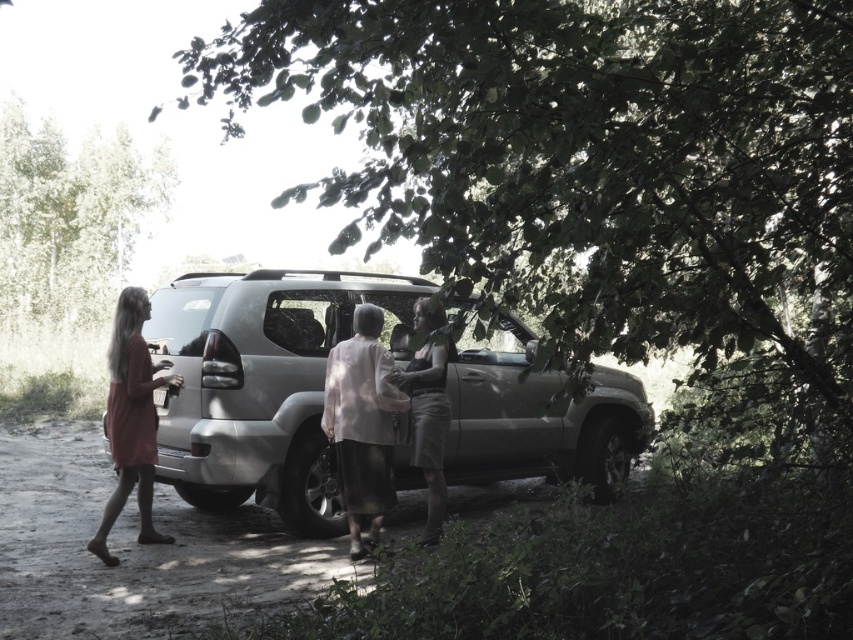
Question: Which object appears closest to the camera in this image?

Choices:
 (A) green leafy tree at center
 (B) satin silver jeep at center

Answer: (A)

Question: Which object is the closest to the light beige skirt at center?

Choices:
 (A) satin silver jeep at center
 (B) green leafy tree at center
 (C) matte pink dress at left
 (D) green leafy tree at upper left

Answer: (A)

Question: Does light beige fabric coat at center appear under matte pink dress at left?

Choices:
 (A) yes
 (B) no

Answer: (A)

Question: Can you confirm if light beige fabric coat at center is positioned below light beige skirt at center?

Choices:
 (A) yes
 (B) no

Answer: (A)

Question: Considering the relative positions of green leafy tree at upper left and matte pink dress at left in the image provided, where is green leafy tree at upper left located with respect to matte pink dress at left?

Choices:
 (A) right
 (B) left

Answer: (B)

Question: Estimate the real-world distances between objects in this image. Which object is farther from the light beige skirt at center?

Choices:
 (A) green leafy tree at upper left
 (B) light beige fabric coat at center

Answer: (A)